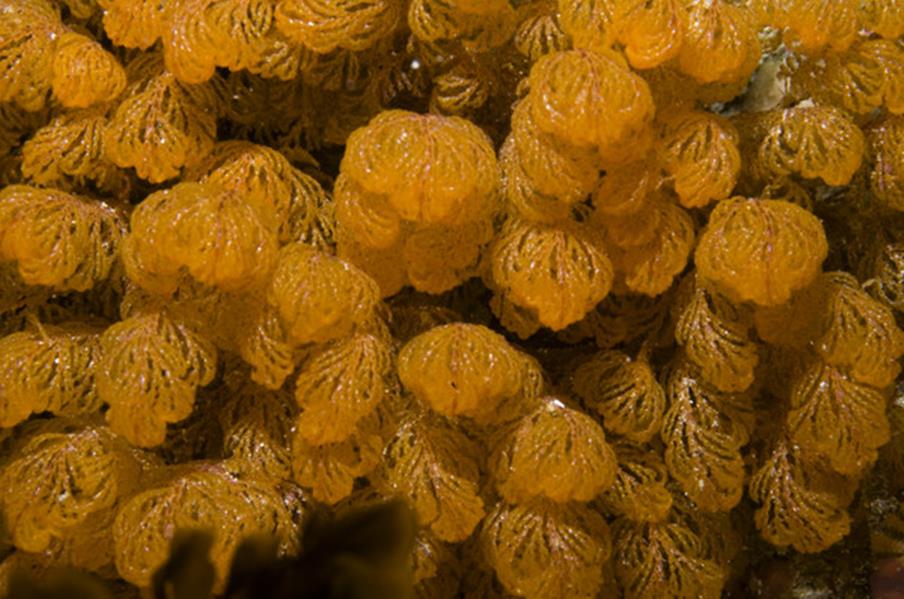
I want to click on plant, so click(276, 57), click(237, 181), click(471, 92), click(539, 170).